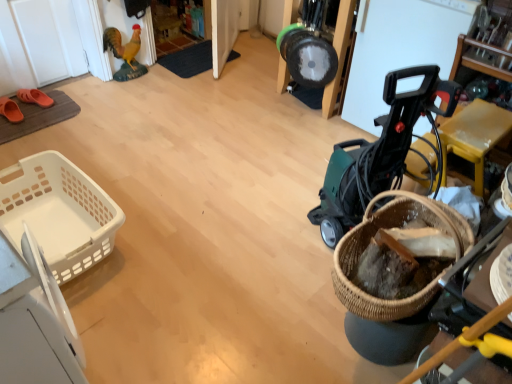
Locate an element on the screen. Image resolution: width=512 pixels, height=384 pixels. vacant space situated on the left part of green plastic baby carriage at right is located at coordinates (273, 230).